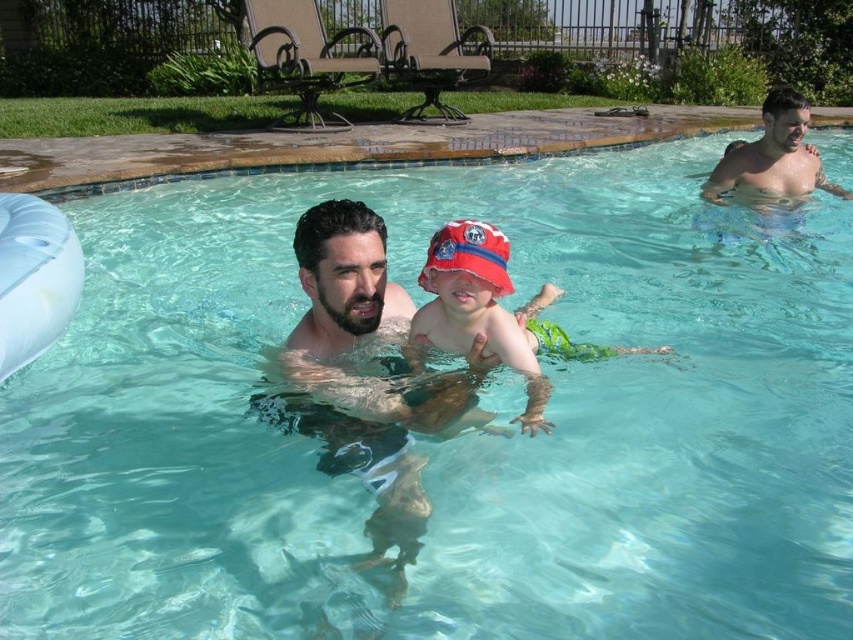
You are a lifeguard standing at the edge of the pool. You need to locate the red fabric bucket hat at center. Where is it positioned in the image?

The red fabric bucket hat at center is positioned at point coordinates of 0.481 on the x axis and 0.559 on the y axis.

You are a photographer standing at the edge of the pool. You want to take a photo of the red fabric bucket hat at center and the smooth skin man at upper right. Based on their positions, which object is closer to you?

The red fabric bucket hat at center is closer to you because it is positioned in front of the smooth skin man at upper right.

You are a photographer trying to capture a closeup shot of the red fabric bucket hat at center and the smooth skin man at upper right. Since you want both subjects to be in focus, you need to adjust your camera settings. Which subject should you focus on to ensure both are sharp?

The red fabric bucket hat at center is smaller than the smooth skin man at upper right, so you should focus on the smooth skin man at upper right to ensure both are in focus.